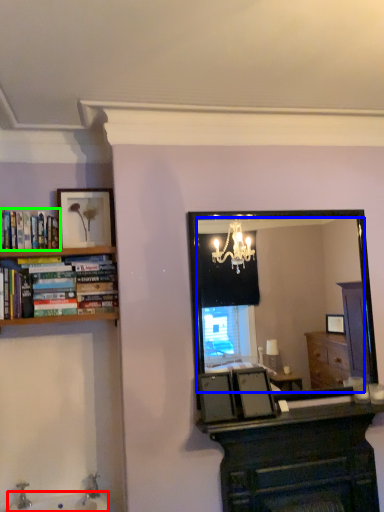
Question: Considering the real-world distances, which object is closest to sink (highlighted by a red box)? mirror (highlighted by a blue box) or book (highlighted by a green box).

Choices:
 (A) mirror
 (B) book

Answer: (B)